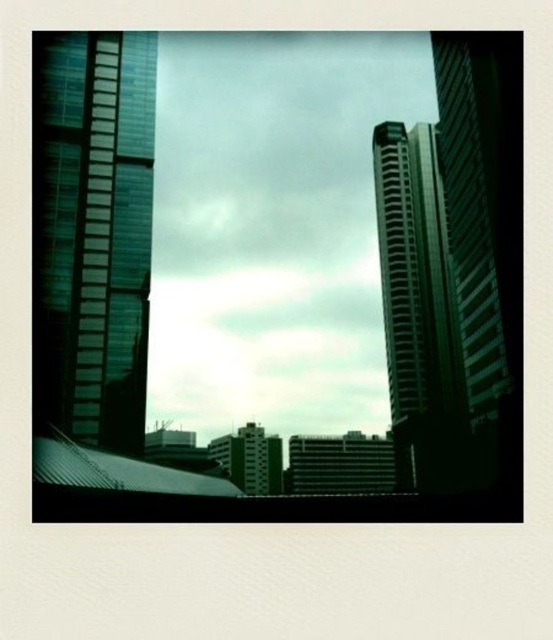
Question: Which point is farther from the camera taking this photo?

Choices:
 (A) (408, 275)
 (B) (105, 340)

Answer: (A)

Question: Is green glass building at left bigger than green glass building at right?

Choices:
 (A) yes
 (B) no

Answer: (B)

Question: Does green glass building at right appear on the left side of glossy glass tower at right?

Choices:
 (A) no
 (B) yes

Answer: (A)

Question: Which point appears closest to the camera in this image?

Choices:
 (A) (466, 362)
 (B) (398, 312)

Answer: (A)

Question: Which of the following is the closest to the observer?

Choices:
 (A) (432, 177)
 (B) (147, 136)
 (C) (458, 134)

Answer: (B)

Question: Is green glass building at left in front of glossy glass tower at right?

Choices:
 (A) no
 (B) yes

Answer: (B)